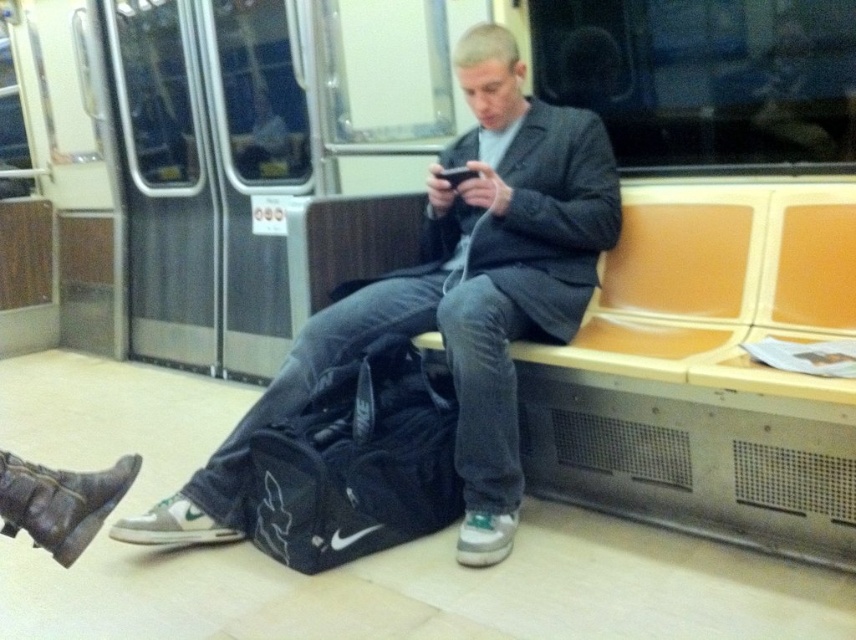
Question: Which point is closer to the camera?

Choices:
 (A) (438, 125)
 (B) (604, 355)
 (C) (269, 513)
 (D) (432, 182)

Answer: (B)

Question: Is metallic silver train at center positioned behind wooden bench at center?

Choices:
 (A) yes
 (B) no

Answer: (A)

Question: Is metallic silver train at center above matte black jacket at center?

Choices:
 (A) yes
 (B) no

Answer: (A)

Question: Which object is positioned farthest from the navy blue fabric bag at lower center?

Choices:
 (A) metallic silver train at center
 (B) matte black jacket at center

Answer: (A)

Question: Based on their relative distances, which object is farther from the navy blue fabric bag at lower center?

Choices:
 (A) wooden bench at center
 (B) metallic silver train at center
 (C) matte black jacket at center

Answer: (B)

Question: From the image, what is the correct spatial relationship of wooden bench at center in relation to matte black jacket at center?

Choices:
 (A) left
 (B) right

Answer: (B)